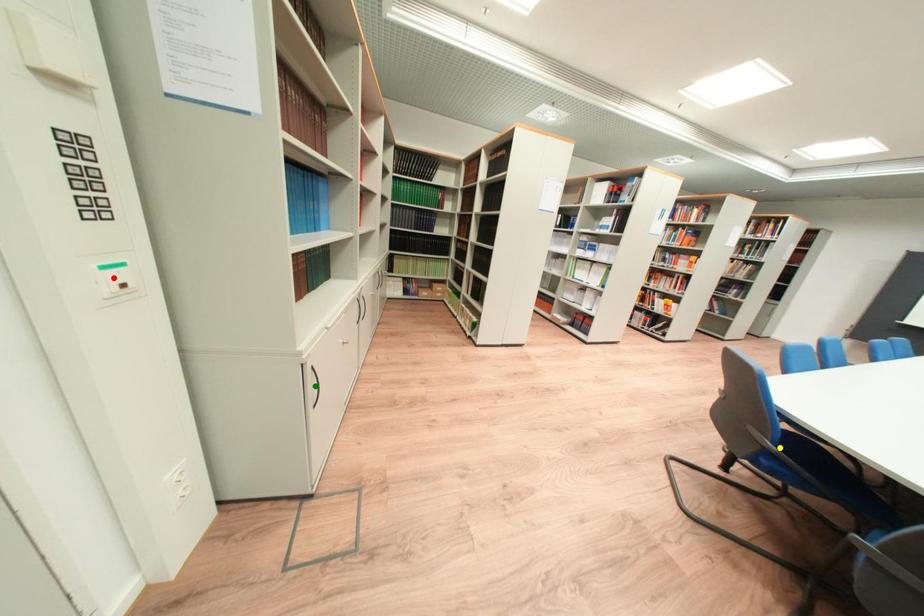
Order these from nearest to farthest:
red point | green point | yellow point

red point
yellow point
green point